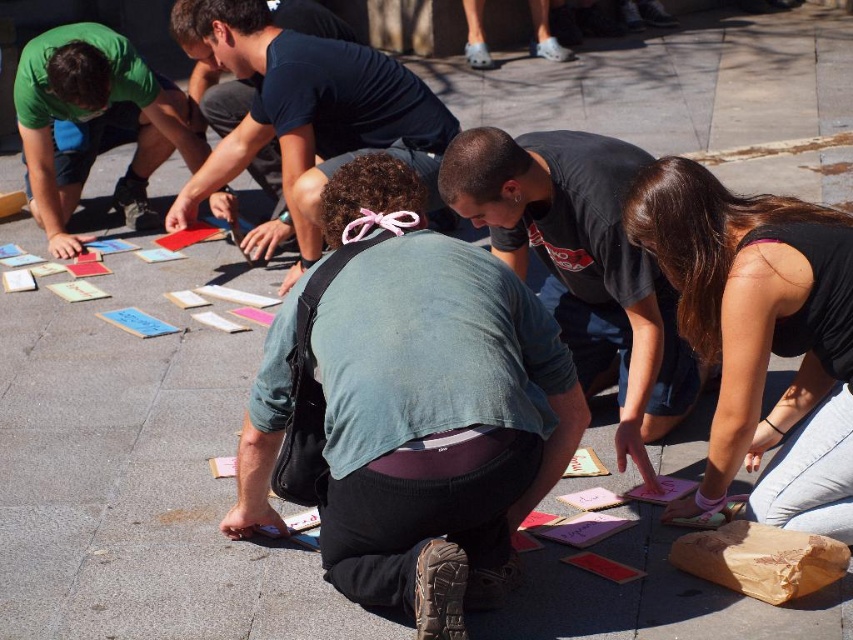
Does point (444, 410) come behind point (675, 506)?

No, it is not.

Who is taller, denim shirt at center or black matte shirt at lower right?

denim shirt at center is taller.

This screenshot has width=853, height=640. Find the location of `denim shirt at center`. denim shirt at center is located at coordinates (430, 406).

Is black matte shirt at lower right to the left of green matte shirt at upper left from the viewer's perspective?

In fact, black matte shirt at lower right is to the right of green matte shirt at upper left.

Is black matte shirt at lower right closer to the viewer compared to green matte shirt at upper left?

Yes, black matte shirt at lower right is in front of green matte shirt at upper left.

You are a GUI agent. You are given a task and a screenshot of the screen. Output one action in this format:
    pyautogui.click(x=<x>, y=<y>)
    Task: Click on the black matte shirt at lower right
    The image size is (853, 640).
    Given the screenshot: What is the action you would take?
    (759, 336)

Image resolution: width=853 pixels, height=640 pixels. Identify the location of black matte shirt at lower right. (759, 336).

Does point (548, 230) lie behind point (76, 29)?

No.

Identify the location of dark gray t-shirt at center. This screenshot has height=640, width=853. (581, 264).